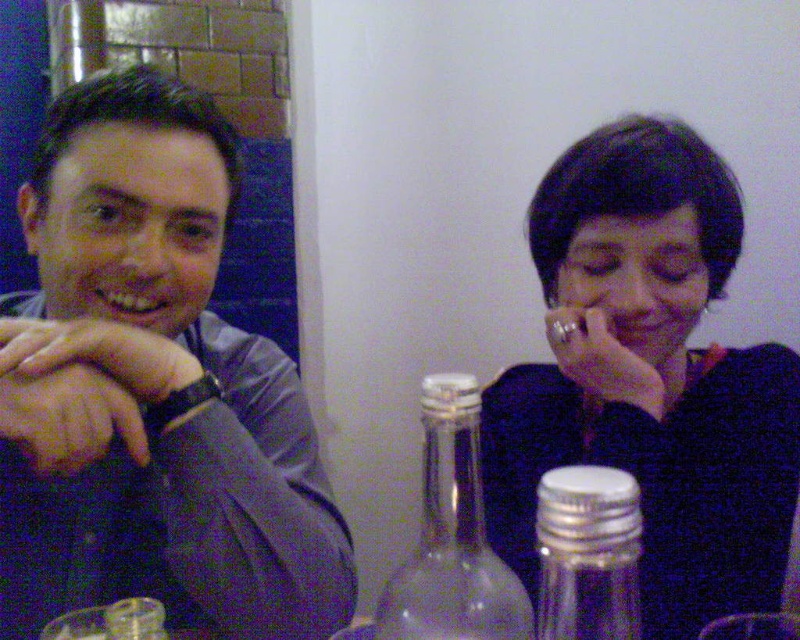
Does dark blue sweater at upper right have a lesser height compared to matte black wristwatch at left?

In fact, dark blue sweater at upper right may be taller than matte black wristwatch at left.

Which is in front, point (728, 554) or point (88, 342)?

Point (88, 342) is in front.

This screenshot has height=640, width=800. What are the coordinates of `dark blue sweater at upper right` in the screenshot? It's located at (648, 378).

Is matte gray shirt at left further to camera compared to clear glass bottle at center?

Yes, matte gray shirt at left is behind clear glass bottle at center.

Can you confirm if matte gray shirt at left is thinner than clear glass bottle at center?

No, matte gray shirt at left is not thinner than clear glass bottle at center.

In order to click on matte gray shirt at left in this screenshot , I will do pyautogui.click(x=152, y=390).

Which is above, clear glass salt shaker at lower right or matte black wristwatch at left?

matte black wristwatch at left is higher up.

Is clear glass salt shaker at lower right positioned in front of matte black wristwatch at left?

Yes, clear glass salt shaker at lower right is closer to the viewer.

At what (x,y) coordinates should I click in order to perform the action: click on clear glass salt shaker at lower right. Please return your answer as a coordinate pair (x, y). The width and height of the screenshot is (800, 640). Looking at the image, I should click on (588, 554).

Identify the location of clear glass salt shaker at lower right. The width and height of the screenshot is (800, 640). (588, 554).